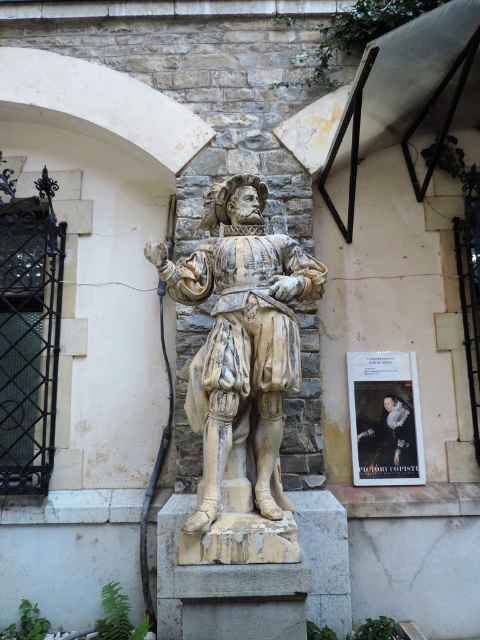
Is point (277, 449) farther from camera compared to point (415, 472)?

That is False.

Which of these two, white marble statue at center or smooth cream statue at center, stands taller?

white marble statue at center is taller.

Locate an element on the screen. The height and width of the screenshot is (640, 480). white marble statue at center is located at coordinates (241, 339).